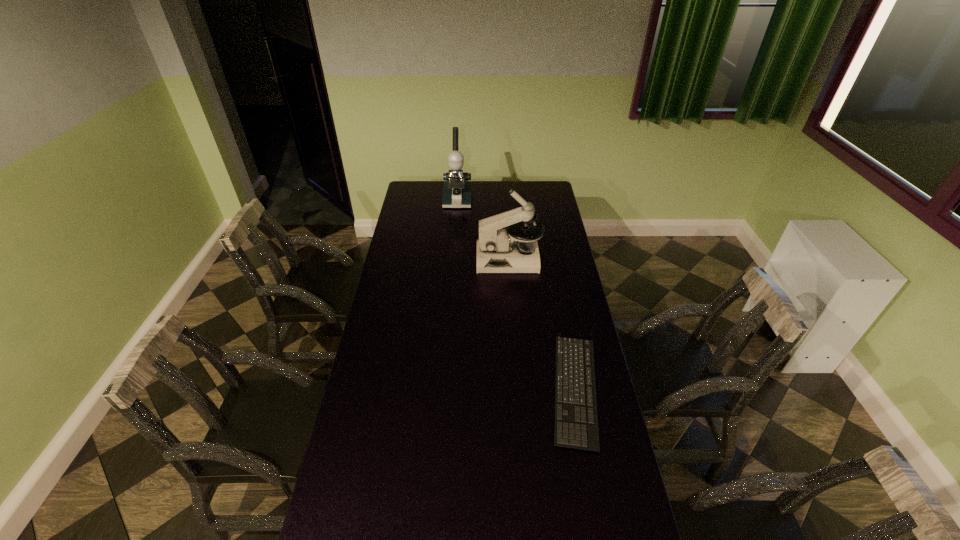
The height and width of the screenshot is (540, 960). Identify the location of vacant space located 0.150m on the back of the computer keyboard. (561, 312).

Locate an element on the screen. object at the far edge is located at coordinates (457, 189).

Image resolution: width=960 pixels, height=540 pixels. Find the location of `microscope located at the right edge`. microscope located at the right edge is located at coordinates (499, 250).

Find the location of a particular element. The width and height of the screenshot is (960, 540). computer keyboard present at the right edge is located at coordinates (570, 434).

In order to click on free space at the left edge of the desktop in this screenshot , I will do `click(377, 378)`.

In the image, there is a desktop. Identify the location of vacant space at the right edge. The width and height of the screenshot is (960, 540). (581, 298).

This screenshot has height=540, width=960. Identify the location of free space at the far left corner of the desktop. (426, 198).

Identify the location of vacant space in between the right microscope and the nearest object. (542, 325).

You are a GUI agent. You are given a task and a screenshot of the screen. Output one action in this format:
    pyautogui.click(x=<x>, y=<y>)
    Task: Click on the unoccupied area between the left microscope and the nearest object
    
    Given the screenshot: What is the action you would take?
    pyautogui.click(x=516, y=294)

Locate which object is the closest to the nearest object. Please provide its 2D coordinates. Your answer should be formatted as a tuple, i.e. [(x, y)], where the tuple contains the x and y coordinates of a point satisfying the conditions above.

[(499, 250)]